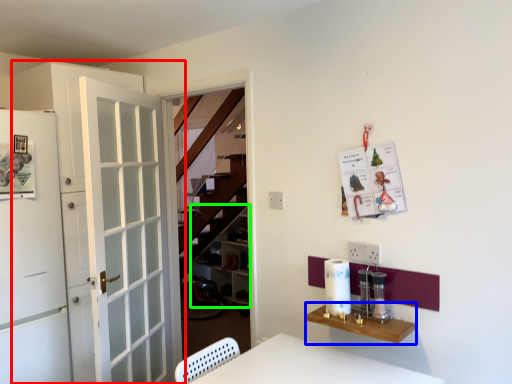
Question: Estimate the real-world distances between objects in this image. Which object is farther from door (highlighted by a red box), table (highlighted by a blue box) or shelf (highlighted by a green box)?

Choices:
 (A) table
 (B) shelf

Answer: (B)